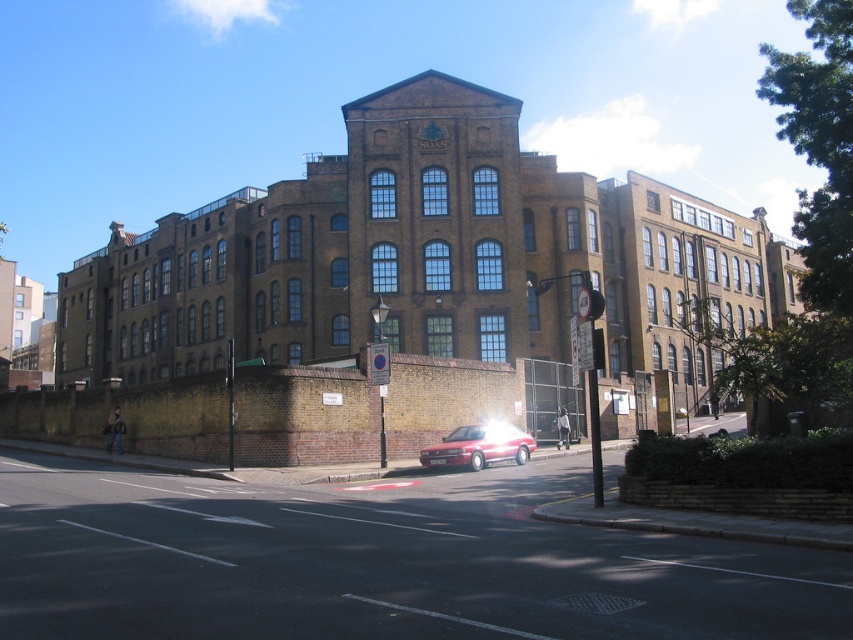
Question: Which point is closer to the camera?

Choices:
 (A) metallic traffic light at center
 (B) glossy red car at center

Answer: (A)

Question: Is black asphalt road at center below glossy red car at center?

Choices:
 (A) no
 (B) yes

Answer: (A)

Question: Which object is farther from the camera taking this photo?

Choices:
 (A) glossy red car at center
 (B) black asphalt road at center

Answer: (A)

Question: Does glossy red car at center lie behind metallic traffic light at center?

Choices:
 (A) yes
 (B) no

Answer: (A)

Question: Which object appears farthest from the camera in this image?

Choices:
 (A) transparent glass traffic light at center
 (B) glossy red car at center
 (C) metallic traffic light at center
 (D) black asphalt road at center

Answer: (B)

Question: Is glossy red car at center smaller than transparent glass traffic light at center?

Choices:
 (A) yes
 (B) no

Answer: (A)